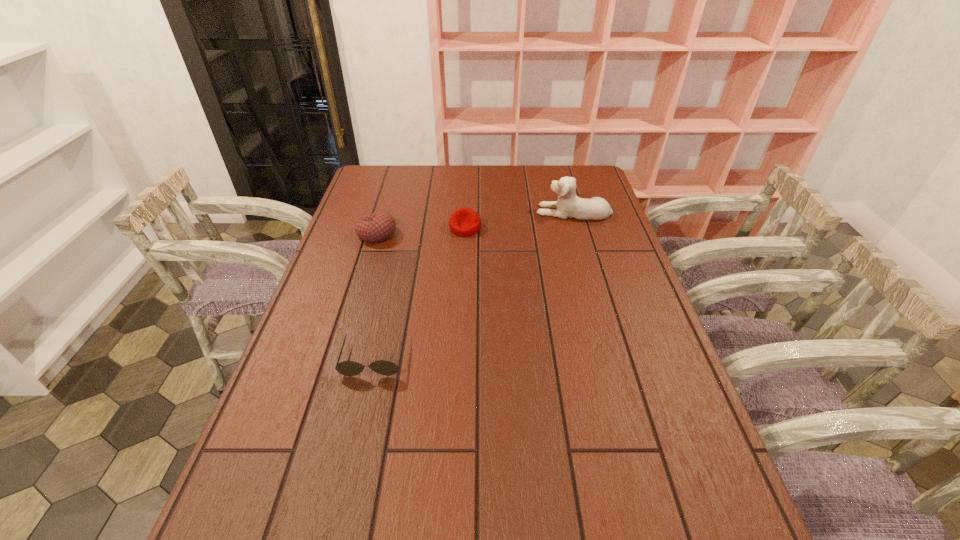
Locate an element on the screen. This screenshot has width=960, height=540. vacant space located 0.180m on the back of the left beanbag is located at coordinates (389, 195).

You are a GUI agent. You are given a task and a screenshot of the screen. Output one action in this format:
    pyautogui.click(x=<x>, y=<y>)
    Task: Click on the vacant region located on the seat area of the third object from left to right
    This screenshot has height=540, width=960.
    Given the screenshot: What is the action you would take?
    pyautogui.click(x=464, y=258)

Where is `free space located 0.050m on the front-facing side of the sunglasses`? This screenshot has width=960, height=540. free space located 0.050m on the front-facing side of the sunglasses is located at coordinates (365, 396).

Locate an element on the screen. This screenshot has width=960, height=540. beanbag that is at the left edge is located at coordinates (379, 226).

This screenshot has height=540, width=960. I want to click on sunglasses situated at the left edge, so click(x=347, y=368).

Identify the location of object that is positioned at the right edge. (568, 205).

Find the location of a particular element. free space at the far edge is located at coordinates (522, 190).

Identify the location of vacant space at the left edge of the desktop. The width and height of the screenshot is (960, 540). [x=323, y=429].

Locate an element on the screen. The width and height of the screenshot is (960, 540). free location at the right edge is located at coordinates (636, 278).

The height and width of the screenshot is (540, 960). Find the location of `free spot at the far left corner of the desktop`. free spot at the far left corner of the desktop is located at coordinates coord(392,179).